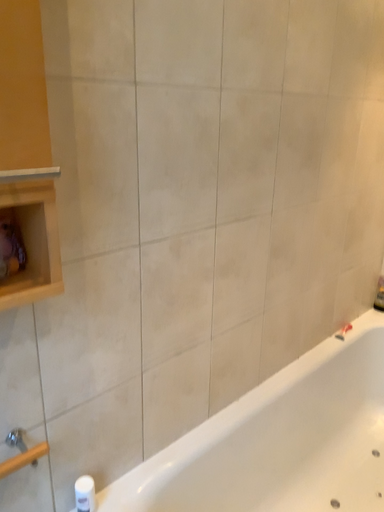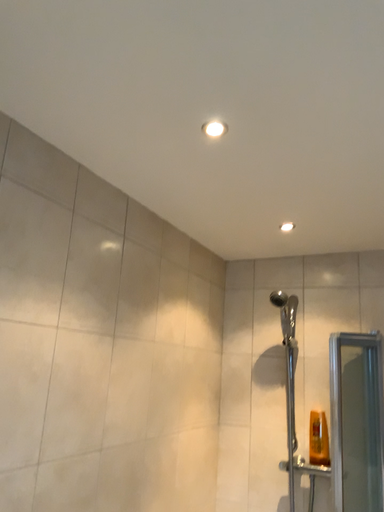
Question: Which way did the camera rotate in the video?

Choices:
 (A) rotated left
 (B) rotated right

Answer: (B)